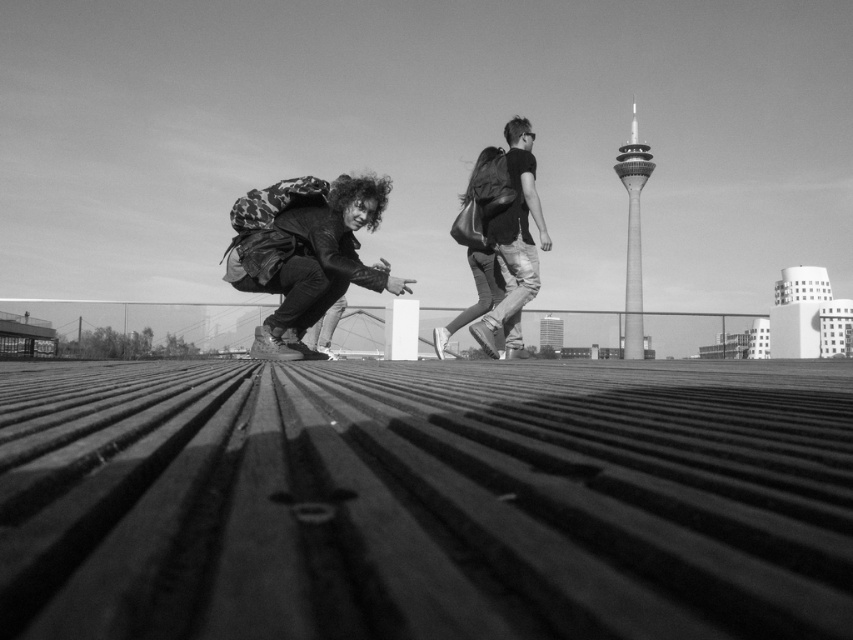
Does point (315, 250) come in front of point (471, 172)?

Yes, point (315, 250) is closer to viewer.

Image resolution: width=853 pixels, height=640 pixels. What do you see at coordinates (305, 253) in the screenshot? I see `camouflage backpack at center` at bounding box center [305, 253].

Locate an element on the screen. camouflage backpack at center is located at coordinates (305, 253).

Image resolution: width=853 pixels, height=640 pixels. I want to click on camouflage backpack at center, so coord(305,253).

Which is more to the left, smooth metallic tower at upper right or leather backpack at center?

Positioned to the left is leather backpack at center.

Can you confirm if smooth metallic tower at upper right is wider than leather backpack at center?

Yes.

You are a GUI agent. You are given a task and a screenshot of the screen. Output one action in this format:
    pyautogui.click(x=<x>, y=<y>)
    Task: Click on the smooth metallic tower at upper right
    The height and width of the screenshot is (640, 853).
    Given the screenshot: What is the action you would take?
    pyautogui.click(x=633, y=234)

Is camouflage backpack at center to the right of smooth metallic tower at upper right from the viewer's perspective?

Incorrect, camouflage backpack at center is not on the right side of smooth metallic tower at upper right.

Is point (312, 182) positioned before point (639, 330)?

Yes.

Is point (264, 202) farther from camera compared to point (641, 333)?

No, it is in front of (641, 333).

At what (x,y) coordinates should I click in order to perform the action: click on camouflage backpack at center. Please return your answer as a coordinate pair (x, y). The width and height of the screenshot is (853, 640). Looking at the image, I should click on (305, 253).